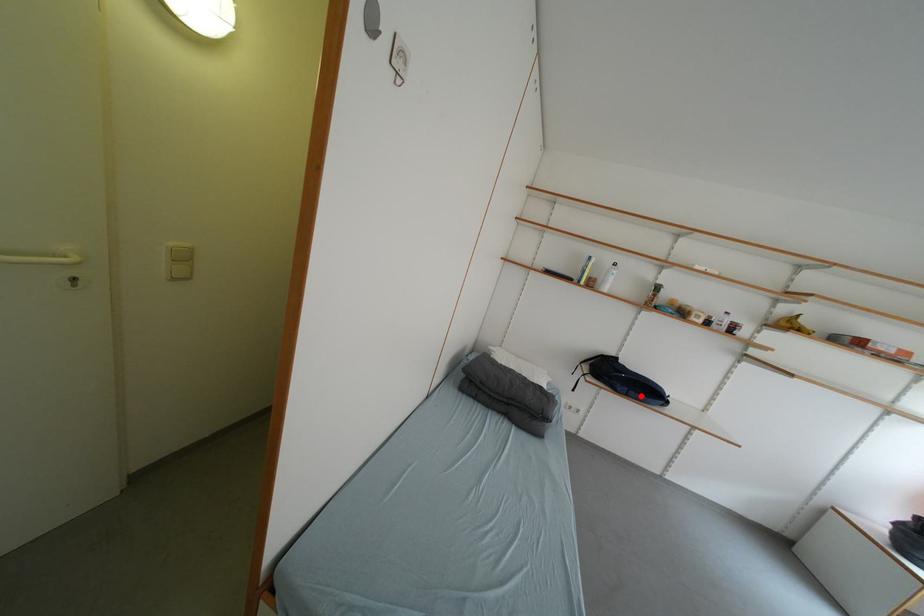
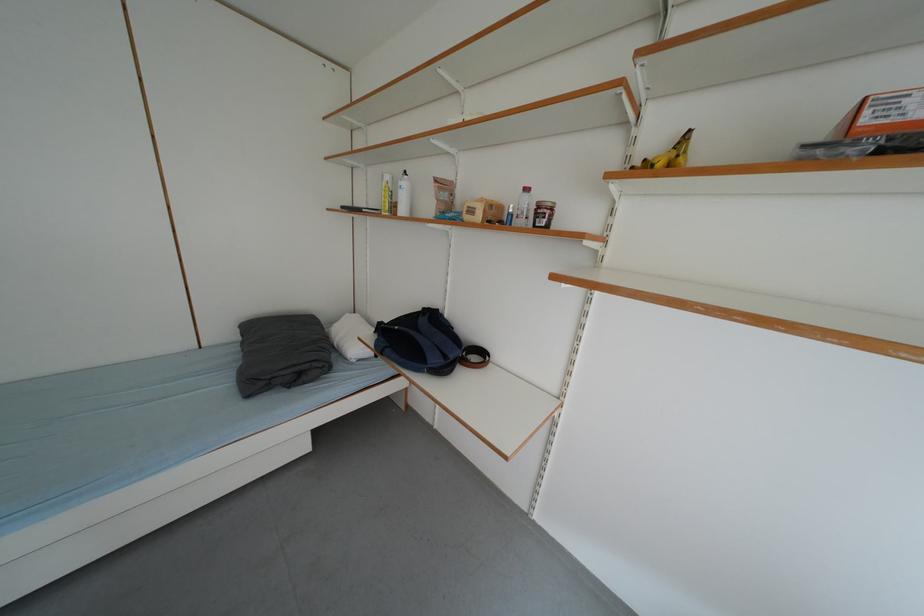
Question: I am providing you with two images of the same scene from different viewpoints. In image1, a red point is highlighted. Considering the same 3D point in image2, which of the following is correct?

Choices:
 (A) It is closer
 (B) It is farther

Answer: (B)